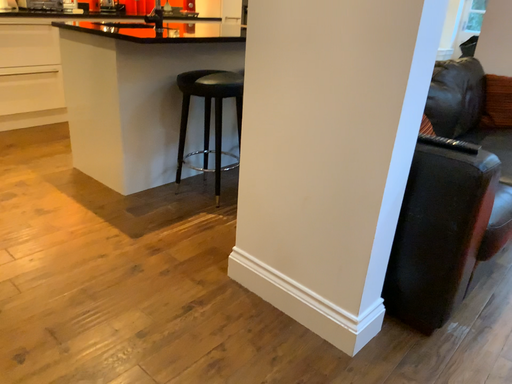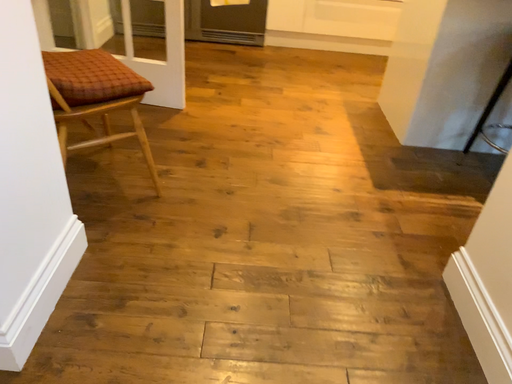
Question: Which way did the camera rotate in the video?

Choices:
 (A) rotated right
 (B) rotated left

Answer: (B)